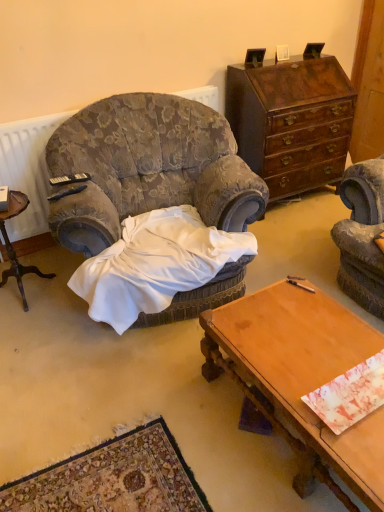
Question: Is mahogany wood dresser at upper right positioned far away from white satin blanket at center?

Choices:
 (A) no
 (B) yes

Answer: (B)

Question: Does mahogany wood dresser at upper right appear on the right side of white satin blanket at center?

Choices:
 (A) yes
 (B) no

Answer: (A)

Question: Is mahogany wood dresser at upper right aimed at white satin blanket at center?

Choices:
 (A) no
 (B) yes

Answer: (A)

Question: Does mahogany wood dresser at upper right contain white satin blanket at center?

Choices:
 (A) no
 (B) yes

Answer: (A)

Question: Is mahogany wood dresser at upper right shorter than white satin blanket at center?

Choices:
 (A) no
 (B) yes

Answer: (A)

Question: Relative to white satin blanket at center, is mahogany wood dresser at upper right in front or behind?

Choices:
 (A) front
 (B) behind

Answer: (B)

Question: Looking at the image, does mahogany wood dresser at upper right seem bigger or smaller compared to white satin blanket at center?

Choices:
 (A) big
 (B) small

Answer: (A)

Question: Is mahogany wood dresser at upper right to the left or to the right of white satin blanket at center in the image?

Choices:
 (A) right
 (B) left

Answer: (A)

Question: From the image's perspective, is mahogany wood dresser at upper right positioned above or below white satin blanket at center?

Choices:
 (A) above
 (B) below

Answer: (A)

Question: From a real-world perspective, is wooden nightstand at left physically located above or below black plastic remote control at left, acting as the second remote control starting from the back?

Choices:
 (A) below
 (B) above

Answer: (A)

Question: Based on their sizes in the image, would you say wooden nightstand at left is bigger or smaller than black plastic remote control at left, the 1th remote control from the front?

Choices:
 (A) big
 (B) small

Answer: (A)

Question: From the image's perspective, is wooden nightstand at left located above or below black plastic remote control at left, the 1th remote control from the front?

Choices:
 (A) above
 (B) below

Answer: (B)

Question: Do you think wooden nightstand at left is within black plastic remote control at left, acting as the second remote control starting from the back, or outside of it?

Choices:
 (A) inside
 (B) outside

Answer: (B)

Question: From a real-world perspective, is marbled paper at center above or below black plastic remote control at upper left, the 1th remote control positioned from the back?

Choices:
 (A) below
 (B) above

Answer: (A)

Question: Based on their sizes in the image, would you say marbled paper at center is bigger or smaller than black plastic remote control at upper left, the 1th remote control positioned from the back?

Choices:
 (A) big
 (B) small

Answer: (A)